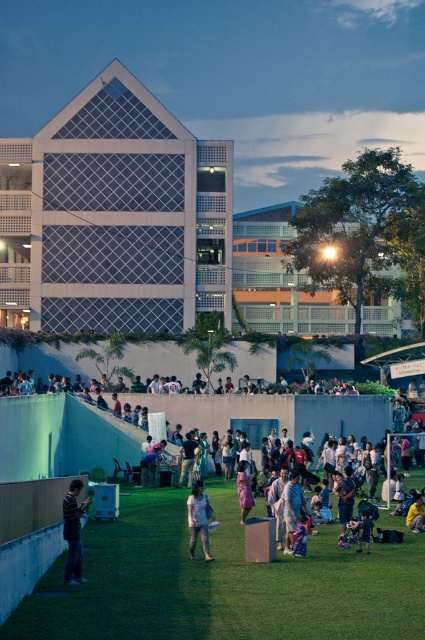
Is green grass at lower center positioned at the back of light blue fabric at center?

No, green grass at lower center is closer to the viewer.

Based on the photo, between green grass at lower center and light blue fabric at center, which one is positioned lower?

green grass at lower center is below.

Is point (19, 618) positioned in front of point (299, 436)?

Yes, it is.

At what (x,y) coordinates should I click in order to perform the action: click on green grass at lower center. Please return your answer as a coordinate pair (x, y). The height and width of the screenshot is (640, 425). Looking at the image, I should click on (223, 582).

Between light brown fabric dress at center and pink fabric dress at center, which one is positioned lower?

Positioned lower is light brown fabric dress at center.

In the scene shown: Which is above, light brown fabric dress at center or pink fabric dress at center?

Positioned higher is pink fabric dress at center.

Image resolution: width=425 pixels, height=640 pixels. What do you see at coordinates (198, 518) in the screenshot? I see `light brown fabric dress at center` at bounding box center [198, 518].

At what (x,y) coordinates should I click in order to perform the action: click on light brown fabric dress at center. Please return your answer as a coordinate pair (x, y). Looking at the image, I should click on (198, 518).

Who is positioned more to the right, striped cotton shirt at lower left or denim shorts at center?

Positioned to the right is denim shorts at center.

Is striped cotton shirt at lower left taller than denim shorts at center?

No.

You are a GUI agent. You are given a task and a screenshot of the screen. Output one action in this format:
    pyautogui.click(x=<x>, y=<y>)
    Task: Click on the striped cotton shirt at lower left
    The image size is (425, 640).
    Given the screenshot: What is the action you would take?
    pyautogui.click(x=73, y=532)